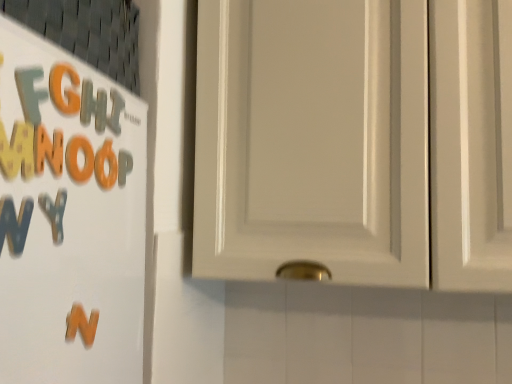
Question: Should I look upward or downward to see orange matte letter at upper left, which is the 4th letter in front-to-back order?

Choices:
 (A) down
 (B) up

Answer: (B)

Question: Considering the relative positions of matte orange letter g at upper left, the second letter in the front-to-back sequence, and matte plastic letter at upper left, acting as the 2th letter starting from the back, in the image provided, is matte orange letter g at upper left, the second letter in the front-to-back sequence, to the left of matte plastic letter at upper left, acting as the 2th letter starting from the back, from the viewer's perspective?

Choices:
 (A) no
 (B) yes

Answer: (B)

Question: Can you confirm if matte orange letter g at upper left, the second letter in the front-to-back sequence, is thinner than matte plastic letter at upper left, acting as the 2th letter starting from the back?

Choices:
 (A) no
 (B) yes

Answer: (B)

Question: Is matte orange letter g at upper left, the second letter in the front-to-back sequence, far from matte plastic letter at upper left, which ranks as the fifth letter in front-to-back order?

Choices:
 (A) yes
 (B) no

Answer: (B)

Question: From the image's perspective, is matte orange letter g at upper left, the second letter in the front-to-back sequence, located beneath matte plastic letter at upper left, acting as the 2th letter starting from the back?

Choices:
 (A) yes
 (B) no

Answer: (B)

Question: From a real-world perspective, is matte orange letter g at upper left, the 5th letter from the back, under matte plastic letter at upper left, which ranks as the fifth letter in front-to-back order?

Choices:
 (A) no
 (B) yes

Answer: (B)

Question: Is matte orange letter g at upper left, the 5th letter from the back, taller than matte plastic letter at upper left, which ranks as the fifth letter in front-to-back order?

Choices:
 (A) no
 (B) yes

Answer: (A)

Question: From a real-world perspective, is orange foam letter at left, placed as the 6th letter when sorted from back to front, positioned under matte plastic letter at upper left, which ranks as the fifth letter in front-to-back order, based on gravity?

Choices:
 (A) no
 (B) yes

Answer: (B)

Question: Can you confirm if orange foam letter at left, which appears as the 1th letter when viewed from the front, is positioned to the left of matte plastic letter at upper left, which ranks as the fifth letter in front-to-back order?

Choices:
 (A) no
 (B) yes

Answer: (B)

Question: Would you say matte plastic letter at upper left, acting as the 2th letter starting from the back, is part of orange foam letter at left, placed as the 6th letter when sorted from back to front,'s contents?

Choices:
 (A) yes
 (B) no

Answer: (B)

Question: Is orange foam letter at left, placed as the 6th letter when sorted from back to front, to the right of matte plastic letter at upper left, which ranks as the fifth letter in front-to-back order, from the viewer's perspective?

Choices:
 (A) no
 (B) yes

Answer: (A)

Question: Is orange foam letter at left, placed as the 6th letter when sorted from back to front, smaller than matte plastic letter at upper left, acting as the 2th letter starting from the back?

Choices:
 (A) no
 (B) yes

Answer: (B)

Question: Is orange foam letter at left, which appears as the 1th letter when viewed from the front, directly adjacent to matte plastic letter at upper left, which ranks as the fifth letter in front-to-back order?

Choices:
 (A) no
 (B) yes

Answer: (A)

Question: Is orange matte letter n at left touching matte orange letter g at upper left, the second letter in the front-to-back sequence?

Choices:
 (A) yes
 (B) no

Answer: (B)